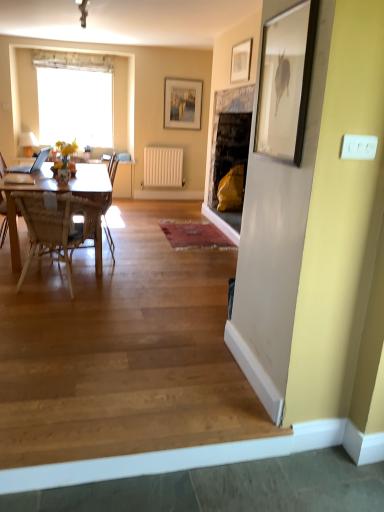
Locate an element on the screen. The image size is (384, 512). free spot above white matte radiator at center (from a real-world perspective) is located at coordinates (170, 141).